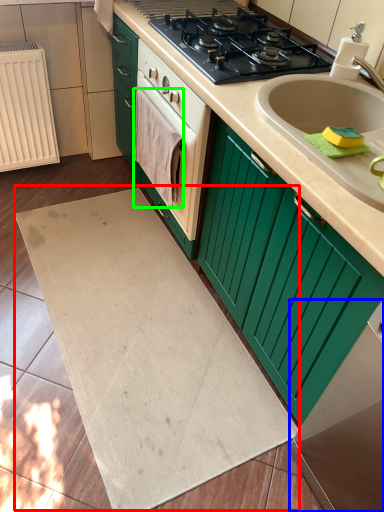
Question: Which object is positioned farthest from bath mat (highlighted by a red box)? Select from appliance (highlighted by a blue box) and hand towel (highlighted by a green box).

Choices:
 (A) appliance
 (B) hand towel

Answer: (B)